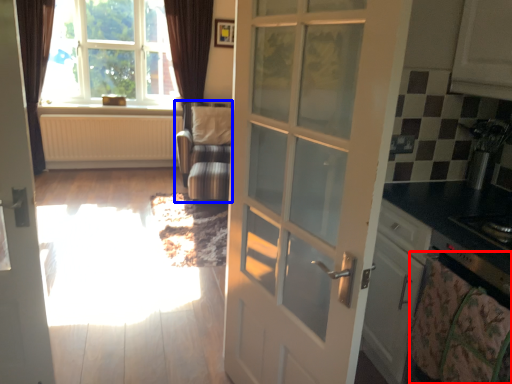
Question: Which object appears farthest to the camera in this image, blanket (highlighted by a red box) or armchair (highlighted by a blue box)?

Choices:
 (A) blanket
 (B) armchair

Answer: (B)